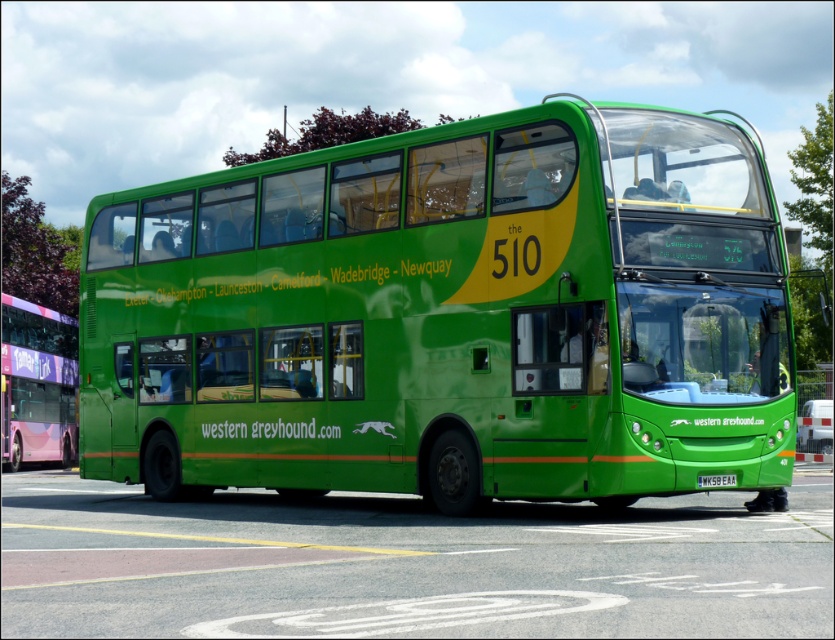
You are standing in front of the Western Greyhound bus with route number 510. You notice two points marked on the bus. The first point is at coordinate (353, 332) and the second point is at (52, 435). Which point is closer to you?

Point (353, 332) is closer to the camera than point (52, 435).